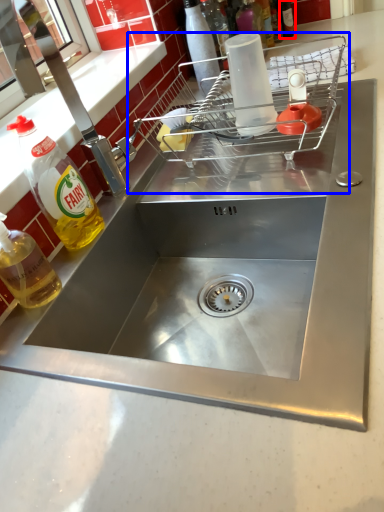
Question: Which of the following is the farthest to the observer, bottle (highlighted by a red box) or appliance (highlighted by a blue box)?

Choices:
 (A) bottle
 (B) appliance

Answer: (A)